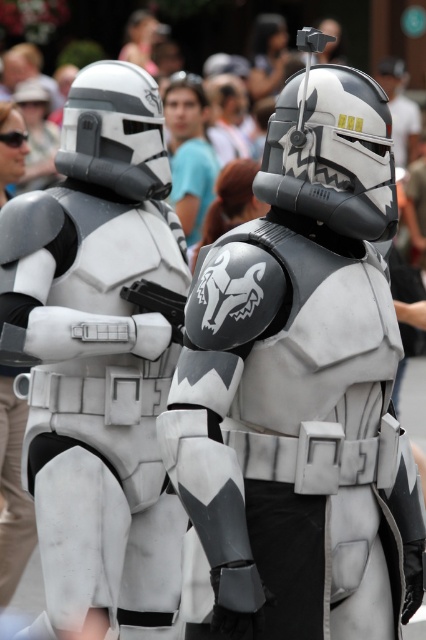
Does white matte armor at center have a lesser height compared to blue cotton shirt at center?

No, white matte armor at center is not shorter than blue cotton shirt at center.

Is point (155, 458) positioned before point (195, 237)?

Yes, point (155, 458) is closer to viewer.

Identify the location of white matte armor at center. Image resolution: width=426 pixels, height=640 pixels. (100, 360).

The height and width of the screenshot is (640, 426). Describe the element at coordinates (189, 152) in the screenshot. I see `blue cotton shirt at center` at that location.

Does blue cotton shirt at center appear on the left side of matte black helmet at upper center?

Yes, blue cotton shirt at center is to the left of matte black helmet at upper center.

Does point (166, 128) come farther from viewer compared to point (393, 129)?

Yes.

Where is `blue cotton shirt at center`? The width and height of the screenshot is (426, 640). blue cotton shirt at center is located at coordinates (189, 152).

Is matte white armor at center smaller than white matte armor at center?

No.

Is matte white armor at center closer to the viewer compared to white matte armor at center?

Yes, it is.

Which is behind, point (195, 563) or point (146, 550)?

The point (146, 550) is behind.

The height and width of the screenshot is (640, 426). In order to click on matte white armor at center in this screenshot , I will do `click(296, 388)`.